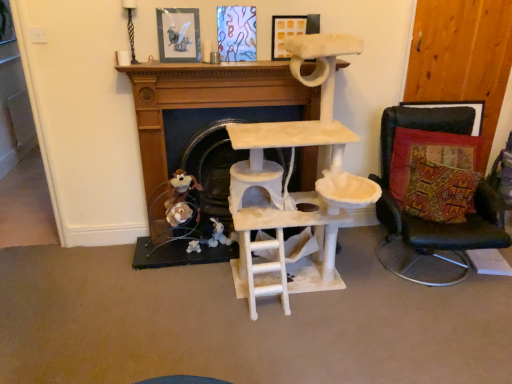
Question: Which direction should I rotate to face matte glass picture frame at upper center, which is the 1th picture frame in left-to-right order, — up or down?

Choices:
 (A) down
 (B) up

Answer: (B)

Question: Is matte yellow picture frame at upper center, placed as the 1th picture frame when sorted from right to left, thinner than multicolored woven cushion at right?

Choices:
 (A) yes
 (B) no

Answer: (A)

Question: Does matte yellow picture frame at upper center, placed as the 1th picture frame when sorted from right to left, come in front of multicolored woven cushion at right?

Choices:
 (A) yes
 (B) no

Answer: (B)

Question: From a real-world perspective, does matte yellow picture frame at upper center, which is the 2th picture frame from left to right, stand above multicolored woven cushion at right?

Choices:
 (A) yes
 (B) no

Answer: (A)

Question: From the image's perspective, is matte yellow picture frame at upper center, which is the 2th picture frame from left to right, under multicolored woven cushion at right?

Choices:
 (A) yes
 (B) no

Answer: (B)

Question: Is matte yellow picture frame at upper center, placed as the 1th picture frame when sorted from right to left, shorter than multicolored woven cushion at right?

Choices:
 (A) yes
 (B) no

Answer: (A)

Question: Is matte yellow picture frame at upper center, placed as the 1th picture frame when sorted from right to left, taller than multicolored woven cushion at right?

Choices:
 (A) no
 (B) yes

Answer: (A)

Question: From the image's perspective, is multicolored woven cushion at right above fuzzy brown plush at lower center?

Choices:
 (A) no
 (B) yes

Answer: (A)

Question: Does multicolored woven cushion at right have a greater height compared to fuzzy brown plush at lower center?

Choices:
 (A) no
 (B) yes

Answer: (B)

Question: Considering the relative sizes of multicolored woven cushion at right and fuzzy brown plush at lower center in the image provided, is multicolored woven cushion at right smaller than fuzzy brown plush at lower center?

Choices:
 (A) no
 (B) yes

Answer: (A)

Question: Can you confirm if multicolored woven cushion at right is bigger than fuzzy brown plush at lower center?

Choices:
 (A) no
 (B) yes

Answer: (B)

Question: Can you see multicolored woven cushion at right touching fuzzy brown plush at lower center?

Choices:
 (A) no
 (B) yes

Answer: (A)

Question: From a real-world perspective, is multicolored woven cushion at right located higher than fuzzy brown plush at lower center?

Choices:
 (A) yes
 (B) no

Answer: (A)

Question: Is there a large distance between fuzzy brown plush at lower center and multicolored woven cushion at right?

Choices:
 (A) no
 (B) yes

Answer: (B)